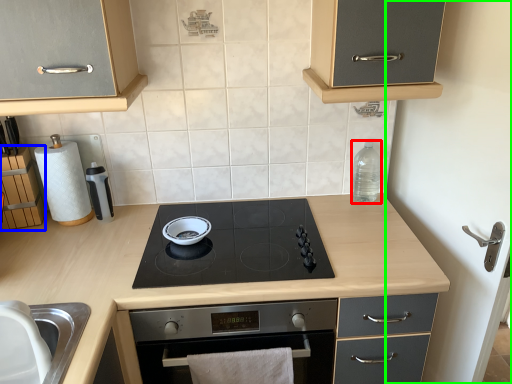
Question: Which is farther away from bottle (highlighted by a red box)? cabinetry (highlighted by a blue box) or side (highlighted by a green box)?

Choices:
 (A) cabinetry
 (B) side

Answer: (A)